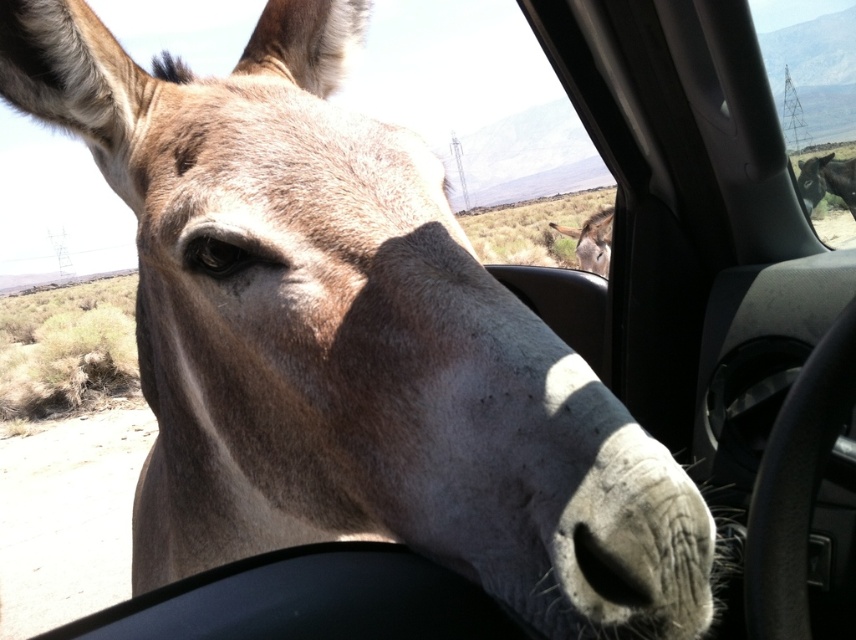
Who is taller, dark brown fur mule at upper right or fuzzy brown mule at center?

dark brown fur mule at upper right

Is point (816, 189) positioned in front of point (578, 246)?

That is False.

At what (x,y) coordinates should I click in order to perform the action: click on dark brown fur mule at upper right. Please return your answer as a coordinate pair (x, y). Looking at the image, I should click on (827, 180).

Who is positioned more to the left, transparent glass donkey at upper right or dark brown fur mule at upper right?

transparent glass donkey at upper right is more to the left.

Can you confirm if transparent glass donkey at upper right is shorter than dark brown fur mule at upper right?

No.

Which is in front, point (843, 35) or point (806, 204)?

Point (806, 204) is in front.

I want to click on transparent glass donkey at upper right, so click(810, 72).

Is point (831, 106) positioned behind point (599, 225)?

Yes, it is.

Is transparent glass donkey at upper right bigger than fuzzy brown mule at center?

Yes.

You are a GUI agent. You are given a task and a screenshot of the screen. Output one action in this format:
    pyautogui.click(x=<x>, y=<y>)
    Task: Click on the transparent glass donkey at upper right
    The height and width of the screenshot is (640, 856).
    Given the screenshot: What is the action you would take?
    pyautogui.click(x=810, y=72)